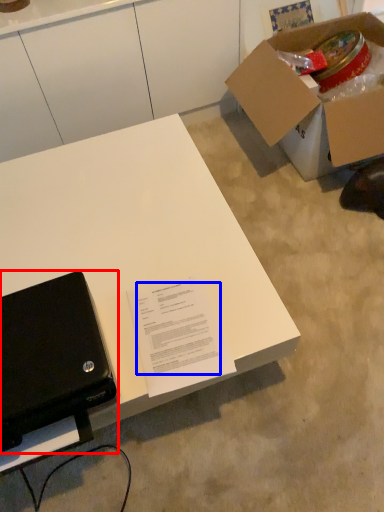
Question: Which point is closer to the camera, laptop (highlighted by a red box) or writing (highlighted by a blue box)?

Choices:
 (A) laptop
 (B) writing

Answer: (A)